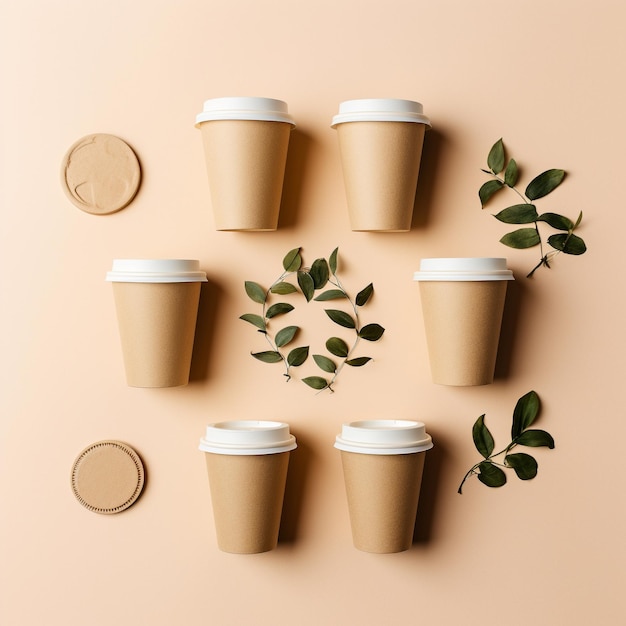
Find the location of a particular element. The height and width of the screenshot is (626, 626). cups on a background of similar color is located at coordinates (242, 533), (386, 485), (452, 344), (392, 192), (262, 162), (177, 326).